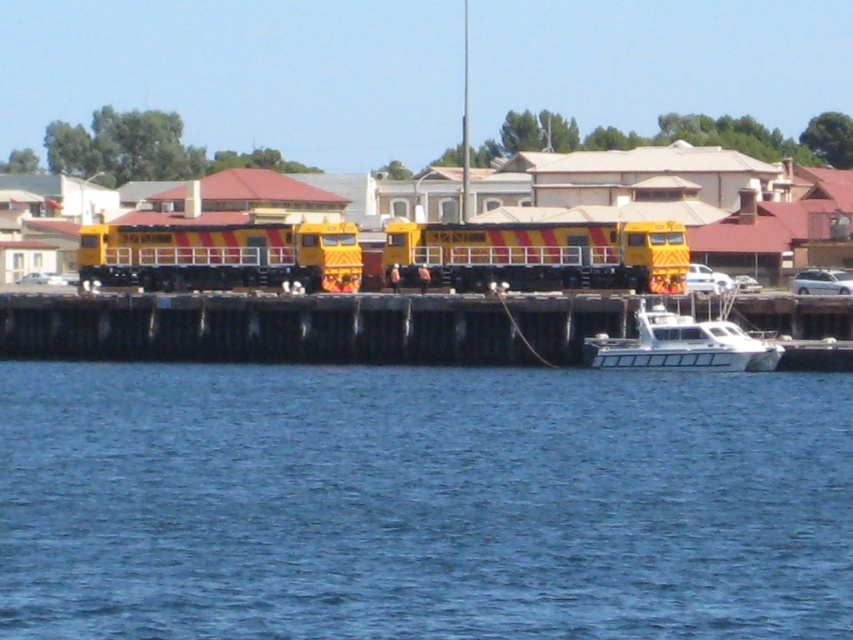
You are standing on the dock and want to take a photo of both the yellow painted metal train at center and the white glossy boat at lower right. Which object should you focus on first to ensure both are in the frame?

You should focus on the yellow painted metal train at center first because it is closer to you than the white glossy boat at lower right, so adjusting the camera to include it will also capture the boat in the background.

You are standing on the dock and want to take a photo of the yellow painted metal train at center. If your camera can only focus on objects within a 0.5 unit radius from the center point of the image, which is at coordinates 0.5, 0.5, will the train be in focus?

The yellow painted metal train at center is located at point (543,253). The distance from the image center (426,320) is sqrt of squared differences, which is sqrt of 0.102 squared plus 0.063 squared. Calculating that gives sqrt of 0.010404 plus 0.003969 equals sqrt of 0.014373, which is approximately 0.12 units. Since 0.12 is less than 0.5, the train is within the focus range and will be in focus.

You are standing on the wooden dock at center and want to board the white glossy boat at lower right. Which direction should you walk to reach the boat?

You should walk to the right because the wooden dock at center is to the left of the white glossy boat at lower right, so moving towards the right along the dock will lead you to the boat.